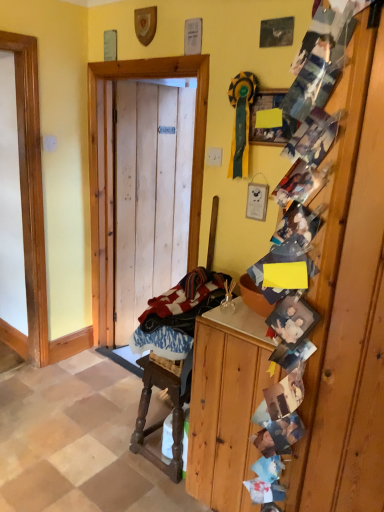
Question: Does matte yellow paper at upper center have a greater width compared to wooden cabinet at right?

Choices:
 (A) no
 (B) yes

Answer: (A)

Question: Considering the relative sizes of matte yellow paper at upper center and wooden cabinet at right in the image provided, is matte yellow paper at upper center shorter than wooden cabinet at right?

Choices:
 (A) yes
 (B) no

Answer: (A)

Question: Does matte yellow paper at upper center turn towards wooden cabinet at right?

Choices:
 (A) no
 (B) yes

Answer: (A)

Question: Can you confirm if matte yellow paper at upper center is taller than wooden cabinet at right?

Choices:
 (A) no
 (B) yes

Answer: (A)

Question: Is wooden cabinet at right at the back of matte yellow paper at upper center?

Choices:
 (A) no
 (B) yes

Answer: (A)

Question: Is wooden cabinet at right inside matte yellow paper at upper center?

Choices:
 (A) yes
 (B) no

Answer: (B)

Question: Is wooden cabinet at right not inside wooden door at center?

Choices:
 (A) yes
 (B) no

Answer: (A)

Question: Can you confirm if wooden cabinet at right is wider than wooden door at center?

Choices:
 (A) no
 (B) yes

Answer: (B)

Question: Does wooden cabinet at right touch wooden door at center?

Choices:
 (A) yes
 (B) no

Answer: (B)

Question: Considering the relative positions of wooden cabinet at right and wooden door at center in the image provided, is wooden cabinet at right to the right of wooden door at center from the viewer's perspective?

Choices:
 (A) no
 (B) yes

Answer: (B)

Question: Is the depth of wooden cabinet at right less than that of wooden door at center?

Choices:
 (A) yes
 (B) no

Answer: (A)

Question: Is wooden cabinet at right further to camera compared to wooden door at center?

Choices:
 (A) yes
 (B) no

Answer: (B)

Question: Would you say wooden door at center is part of wooden carved rocking chair at center's contents?

Choices:
 (A) no
 (B) yes

Answer: (A)